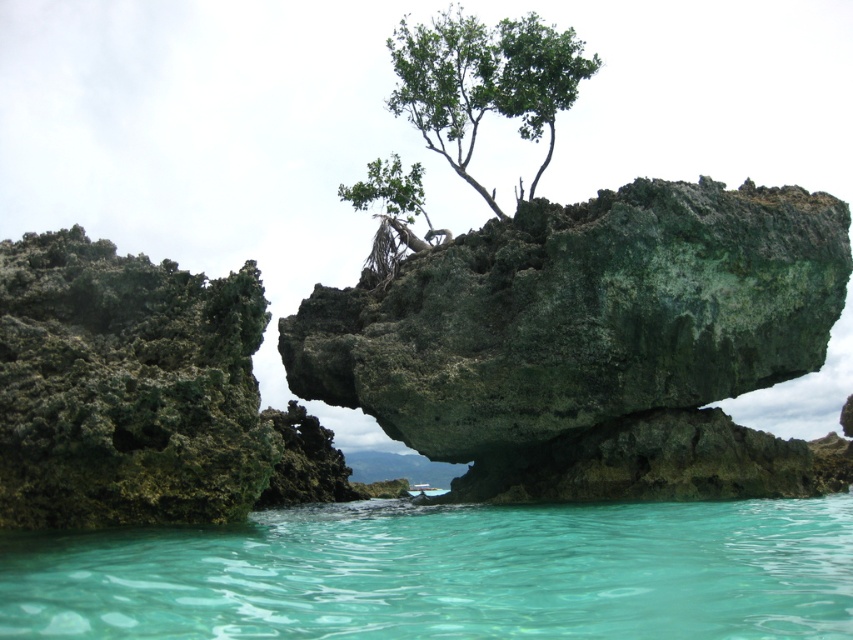
Question: Which of these objects is positioned closest to the green leafy tree at upper center?

Choices:
 (A) green mossy rock at center
 (B) green mossy rock at left

Answer: (A)

Question: Is clear water at lower center to the left of green leafy tree at upper center from the viewer's perspective?

Choices:
 (A) yes
 (B) no

Answer: (B)

Question: Which of the following is the closest to the observer?

Choices:
 (A) green leafy tree at upper center
 (B) green mossy rock at left

Answer: (B)

Question: Does clear water at lower center lie behind green mossy rock at left?

Choices:
 (A) no
 (B) yes

Answer: (A)

Question: Does green mossy rock at center lie in front of green mossy rock at left?

Choices:
 (A) yes
 (B) no

Answer: (B)

Question: Which point is closer to the camera?

Choices:
 (A) green mossy rock at left
 (B) clear water at lower center

Answer: (B)